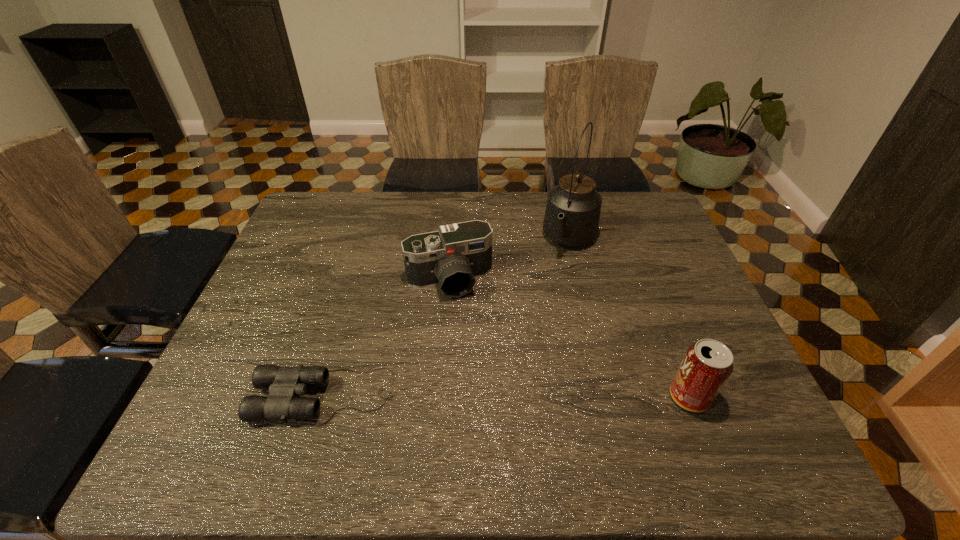
In the image, there is a desktop. Where is `vacant space at the far edge`? This screenshot has width=960, height=540. vacant space at the far edge is located at coordinates (380, 205).

Find the location of a particular element. This screenshot has width=960, height=540. free point at the near edge is located at coordinates (546, 390).

Identify the location of free space at the left edge. The height and width of the screenshot is (540, 960). (316, 244).

Find the location of a particular element. The height and width of the screenshot is (540, 960). vacant space at the right edge is located at coordinates (710, 336).

Where is `vacant space at the far right corner of the desktop`? vacant space at the far right corner of the desktop is located at coordinates (648, 233).

You are a GUI agent. You are given a task and a screenshot of the screen. Output one action in this format:
    pyautogui.click(x=<x>, y=<y>)
    Task: Click on the free space at the near right corner of the desktop
    This screenshot has width=960, height=540.
    Given the screenshot: What is the action you would take?
    pyautogui.click(x=746, y=386)

The height and width of the screenshot is (540, 960). What are the coordinates of `free space between the binoculars and the camera` in the screenshot? It's located at (387, 338).

Image resolution: width=960 pixels, height=540 pixels. In order to click on vacant area between the camera and the tallest object in this screenshot , I will do `click(510, 260)`.

Locate an element on the screen. Image resolution: width=960 pixels, height=540 pixels. vacant area that lies between the camera and the soda can is located at coordinates (x=569, y=339).

Where is `empty location between the shortest object and the tallest object`? This screenshot has width=960, height=540. empty location between the shortest object and the tallest object is located at coordinates (447, 318).